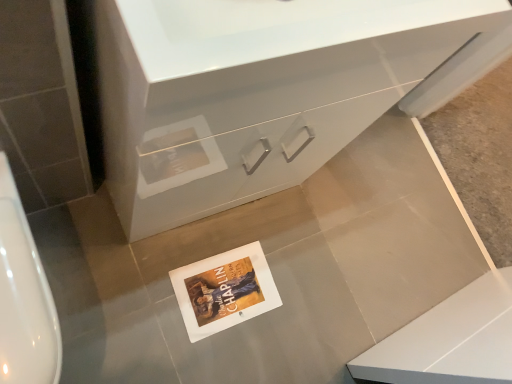
Question: Does point [266, 279] appear closer or farther from the camera than point [175, 223]?

Choices:
 (A) closer
 (B) farther

Answer: (B)

Question: Considering the positions of white paper postcard at center and white glossy cabinet at center in the image, is white paper postcard at center wider or thinner than white glossy cabinet at center?

Choices:
 (A) wide
 (B) thin

Answer: (B)

Question: Based on their relative distances, which object is farther from the white glossy urinal at left?

Choices:
 (A) white paper postcard at center
 (B) white glossy cabinet at center

Answer: (A)

Question: Which object is the closest to the white glossy cabinet at center?

Choices:
 (A) white paper postcard at center
 (B) white glossy urinal at left

Answer: (B)